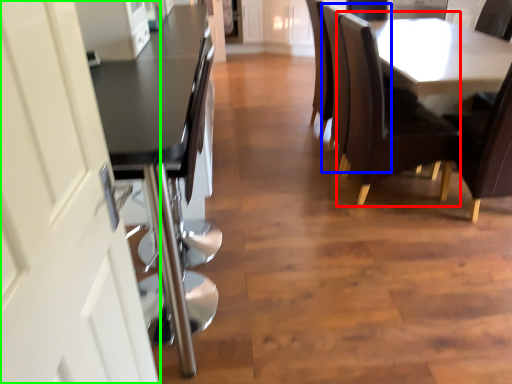
Question: Which object is positioned closest to chair (highlighted by a red box)? Select from armchair (highlighted by a blue box) and screen door (highlighted by a green box).

Choices:
 (A) armchair
 (B) screen door

Answer: (A)